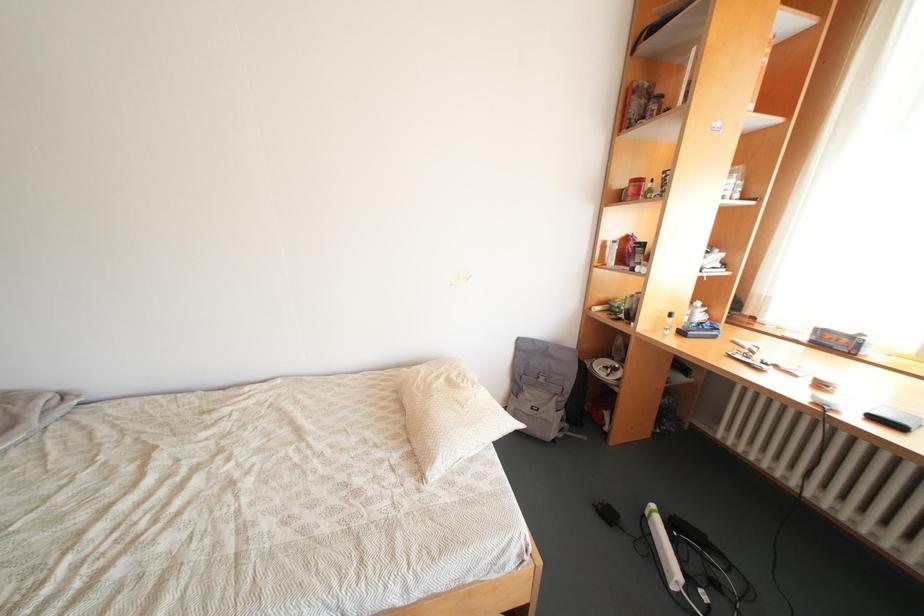
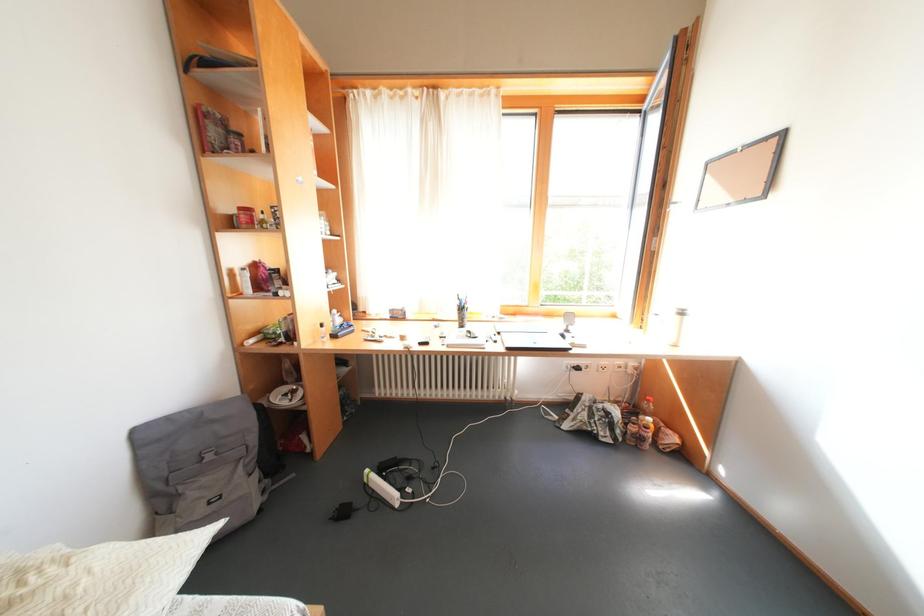
Question: The first image is from the beginning of the video and the second image is from the end. How did the camera likely rotate when shooting the video?

Choices:
 (A) Left
 (B) Right
 (C) Up
 (D) Down

Answer: (B)